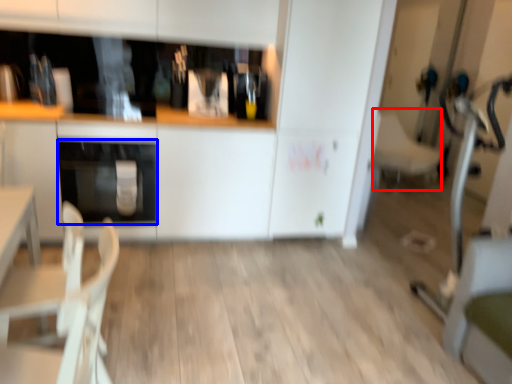
Question: Among these objects, which one is farthest to the camera, armchair (highlighted by a red box) or oven (highlighted by a blue box)?

Choices:
 (A) armchair
 (B) oven

Answer: (A)